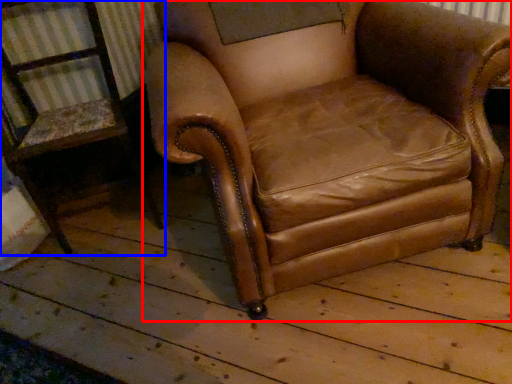
Question: Which of the following is the farthest to the observer, chair (highlighted by a red box) or chair (highlighted by a blue box)?

Choices:
 (A) chair
 (B) chair

Answer: (B)